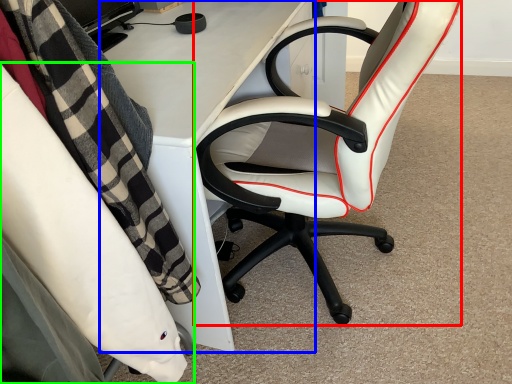
Question: Which is nearer to the chair (highlighted by a red box)? desk (highlighted by a blue box) or chair (highlighted by a green box).

Choices:
 (A) desk
 (B) chair

Answer: (A)